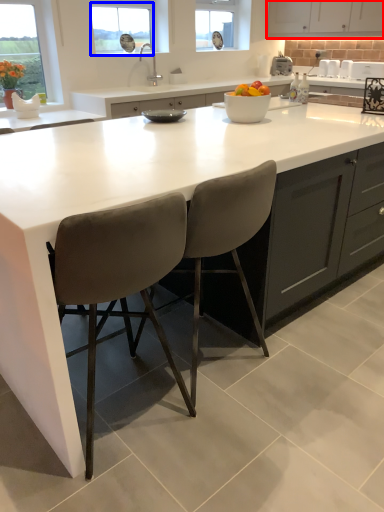
Question: Which object is further to the camera taking this photo, cabinetry (highlighted by a red box) or window (highlighted by a blue box)?

Choices:
 (A) cabinetry
 (B) window

Answer: (A)